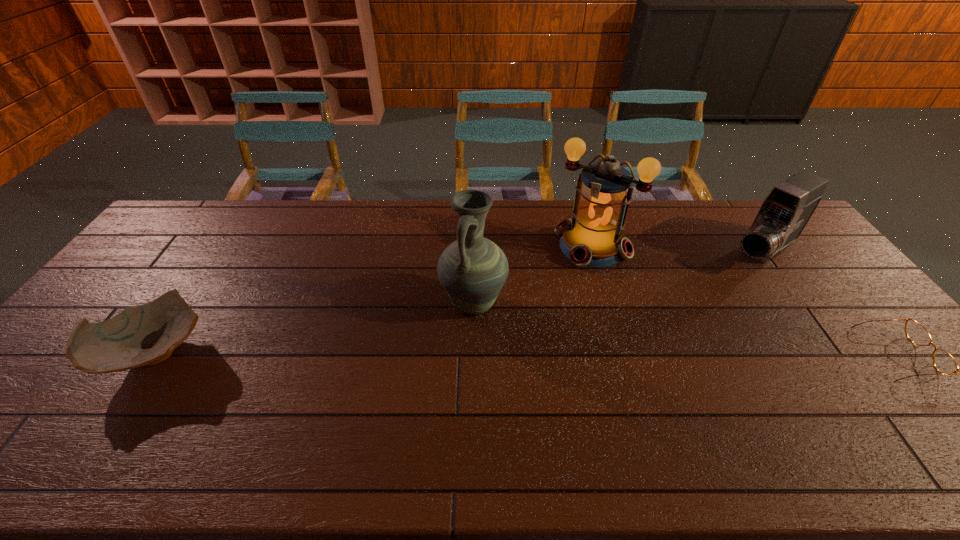
Where is `spectacles positioned at the right edge`? spectacles positioned at the right edge is located at coordinates (943, 362).

Find the location of a particular element. This screenshot has width=960, height=540. camcorder at the right edge is located at coordinates (783, 215).

At what (x,y) coordinates should I click in order to perform the action: click on object that is at the near left corner. Please return your answer as a coordinate pair (x, y). This screenshot has width=960, height=540. Looking at the image, I should click on (144, 335).

Where is `object that is at the far right corner`? Image resolution: width=960 pixels, height=540 pixels. object that is at the far right corner is located at coordinates (783, 215).

I want to click on vacant space at the far edge of the desktop, so click(659, 228).

Locate an element on the screen. The height and width of the screenshot is (540, 960). free point at the near edge is located at coordinates (548, 414).

In the image, there is a desktop. Where is `blank space at the left edge`? Image resolution: width=960 pixels, height=540 pixels. blank space at the left edge is located at coordinates (117, 310).

You are a GUI agent. You are given a task and a screenshot of the screen. Output one action in this format:
    pyautogui.click(x=<x>, y=<y>)
    Task: Click on the free space at the right edge of the desktop
    
    Given the screenshot: What is the action you would take?
    pyautogui.click(x=795, y=288)

At what (x,y) coordinates should I click in order to perform the action: click on vacant space at the near left corner of the desktop. Please return your answer as a coordinate pair (x, y). This screenshot has height=540, width=960. Looking at the image, I should click on (41, 407).

The height and width of the screenshot is (540, 960). What are the coordinates of `empty location between the leftmost object and the pitcher` in the screenshot? It's located at (315, 327).